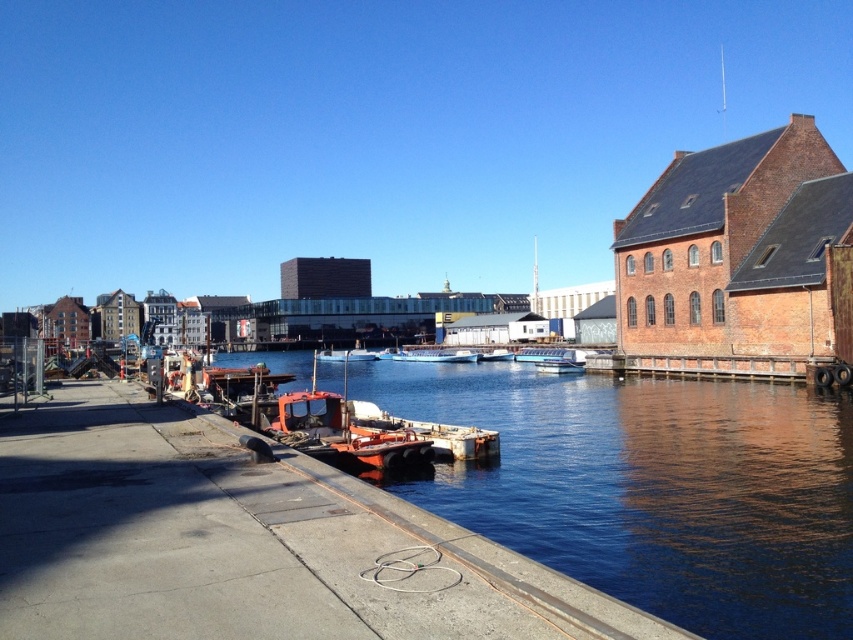
Does white matte boat at center come in front of metallic orange boat at center?

Yes, it is in front of metallic orange boat at center.

Between white matte boat at center and metallic orange boat at center, which one is positioned higher?

white matte boat at center is higher up.

Is point (412, 358) in front of point (337, 356)?

Yes, point (412, 358) is closer to viewer.

Find the location of a particular element. The width and height of the screenshot is (853, 640). white matte boat at center is located at coordinates 434,355.

Is blue water at lower left positioned before metallic orange boat at center?

Yes, it is.

Does point (741, 458) come closer to viewer compared to point (364, 355)?

That is True.

You are a GUI agent. You are given a task and a screenshot of the screen. Output one action in this format:
    pyautogui.click(x=<x>, y=<y>)
    Task: Click on the blue water at lower left
    This screenshot has width=853, height=640.
    Given the screenshot: What is the action you would take?
    pyautogui.click(x=650, y=486)

Find the location of a particular element. blue water at lower left is located at coordinates (650, 486).

The image size is (853, 640). Describe the element at coordinates (434, 355) in the screenshot. I see `white matte boat at center` at that location.

Which is above, white matte boat at center or white plastic boat at center?

white plastic boat at center

Is point (419, 355) more distant than point (579, 371)?

Yes, point (419, 355) is behind point (579, 371).

Find the location of a particular element. Image resolution: width=853 pixels, height=640 pixels. white matte boat at center is located at coordinates (434, 355).